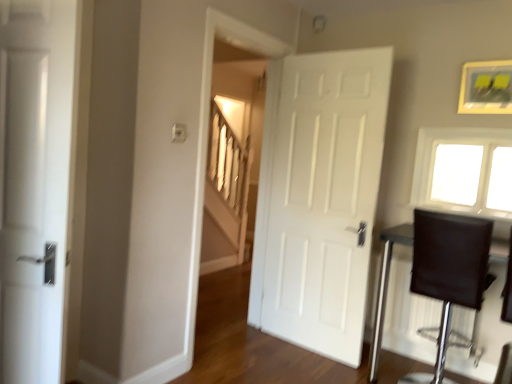
At what (x,y) coordinates should I click in order to perform the action: click on dark brown leather table at right. Please return your answer as a coordinate pair (x, y). The width and height of the screenshot is (512, 384). Looking at the image, I should click on point(386,287).

The width and height of the screenshot is (512, 384). Describe the element at coordinates (35, 184) in the screenshot. I see `white matte door at left, which is the first door in front-to-back order` at that location.

Where is `white matte door at left, which is counted as the second door, starting from the right`? The width and height of the screenshot is (512, 384). white matte door at left, which is counted as the second door, starting from the right is located at coordinates (35, 184).

Measure the distance between white glass window at upper right and camera.

The distance of white glass window at upper right from camera is 8.36 feet.

Find the location of a particular element. The width and height of the screenshot is (512, 384). white glass window at upper right is located at coordinates (464, 170).

Find the location of a particular element. dark brown leather table at right is located at coordinates (386, 287).

In the scene shown: In the image, is dark brown leather table at right positioned in front of or behind gold-framed picture at upper right?

dark brown leather table at right is positioned closer to the viewer than gold-framed picture at upper right.

Is dark brown leather table at right touching gold-framed picture at upper right?

dark brown leather table at right and gold-framed picture at upper right are clearly separated.

Does dark brown leather table at right appear on the right side of gold-framed picture at upper right?

No, dark brown leather table at right is not to the right of gold-framed picture at upper right.

From a real-world perspective, which object stands above the other?

gold-framed picture at upper right.

From the image's perspective, who appears lower, white glass window at upper right or white matte door at center, which is the 2th door in left-to-right order?

white matte door at center, which is the 2th door in left-to-right order, appears lower in the image.

Image resolution: width=512 pixels, height=384 pixels. There is a white glass window at upper right. What are the coordinates of `the 2nd door below it (from a real-world perspective)` in the screenshot? It's located at (319, 198).

How many degrees apart are the facing directions of white glass window at upper right and white matte door at center, which appears as the second door when viewed from the front?

3.4 degrees.

Are white matte door at left, which is counted as the 1th door, starting from the left, and white glass window at upper right beside each other?

white matte door at left, which is counted as the 1th door, starting from the left, is not next to white glass window at upper right, and they're not touching.

Would you say white matte door at left, which is counted as the 1th door, starting from the left, is inside or outside white glass window at upper right?

white matte door at left, which is counted as the 1th door, starting from the left, is outside white glass window at upper right.

Does white matte door at left, which is counted as the 1th door, starting from the left, come in front of white glass window at upper right?

Yes, the depth of white matte door at left, which is counted as the 1th door, starting from the left, is less than that of white glass window at upper right.

Is dark brown leather table at right to the left of white matte door at left, which is the first door in front-to-back order, from the viewer's perspective?

Incorrect, dark brown leather table at right is not on the left side of white matte door at left, which is the first door in front-to-back order.

How many degrees apart are the facing directions of dark brown leather table at right and white matte door at left, which is the first door in front-to-back order?

There is a 155-degree angle between the facing directions of dark brown leather table at right and white matte door at left, which is the first door in front-to-back order.

Is dark brown leather table at right not close to white matte door at left, which is the first door in front-to-back order?

dark brown leather table at right is far away from white matte door at left, which is the first door in front-to-back order.

Is point (405, 232) positioned behind point (37, 322)?

Yes, point (405, 232) is farther from viewer.

How different are the orientations of gold-framed picture at upper right and white matte door at left, placed as the second door when sorted from back to front, in degrees?

They differ by 155 degrees in their facing directions.

Is gold-framed picture at upper right shorter than white matte door at left, which is counted as the 1th door, starting from the left?

Indeed, gold-framed picture at upper right has a lesser height compared to white matte door at left, which is counted as the 1th door, starting from the left.

Considering the sizes of objects gold-framed picture at upper right and white matte door at left, which is counted as the 1th door, starting from the left, in the image provided, who is thinner, gold-framed picture at upper right or white matte door at left, which is counted as the 1th door, starting from the left,?

gold-framed picture at upper right.

The width and height of the screenshot is (512, 384). In order to click on the 1st door directly beneath the gold-framed picture at upper right (from a real-world perspective) in this screenshot , I will do `click(35, 184)`.

Is point (16, 224) farther from viewer compared to point (412, 239)?

No.

Considering the sizes of objects white matte door at left, which is the first door in front-to-back order, and dark brown leather table at right in the image provided, who is smaller, white matte door at left, which is the first door in front-to-back order, or dark brown leather table at right?

With smaller size is white matte door at left, which is the first door in front-to-back order.

From the image's perspective, which one is positioned lower, white matte door at left, which is counted as the 1th door, starting from the left, or dark brown leather table at right?

dark brown leather table at right, from the image's perspective.

Considering the positions of point (474, 105) and point (388, 231), is point (474, 105) closer or farther from the camera than point (388, 231)?

Point (474, 105) is closer to the camera than point (388, 231).

Which is correct: gold-framed picture at upper right is inside dark brown leather table at right, or outside of it?

gold-framed picture at upper right lies outside dark brown leather table at right.

Who is smaller, gold-framed picture at upper right or dark brown leather table at right?

gold-framed picture at upper right is smaller.

How different are the orientations of gold-framed picture at upper right and dark brown leather table at right in degrees?

0.204 degrees separate the facing orientations of gold-framed picture at upper right and dark brown leather table at right.

The image size is (512, 384). Find the location of `table located on the left of gold-framed picture at upper right`. table located on the left of gold-framed picture at upper right is located at coordinates (386, 287).

Find the location of `door behind the white glass window at upper right`. door behind the white glass window at upper right is located at coordinates (319, 198).

Estimate the real-world distances between objects in this image. Which object is closer to white glass window at upper right, white matte door at center, which is the 2th door in left-to-right order, or dark brown leather table at right?

Based on the image, dark brown leather table at right appears to be nearer to white glass window at upper right.

From the image, which object appears to be nearer to gold-framed picture at upper right, white glass window at upper right or dark brown leather table at right?

The object closer to gold-framed picture at upper right is white glass window at upper right.

Which object lies further to the anchor point dark brown leather table at right, white glass window at upper right or white matte door at center, which appears as the second door when viewed from the front?

white matte door at center, which appears as the second door when viewed from the front.

In the scene shown: Estimate the real-world distances between objects in this image. Which object is further from white matte door at center, which appears as the second door when viewed from the front, white glass window at upper right or dark brown leather table at right?

white glass window at upper right is positioned further to the anchor white matte door at center, which appears as the second door when viewed from the front.

Which object lies nearer to the anchor point gold-framed picture at upper right, dark brown leather table at right or white matte door at center, the first door viewed from the back?

Among the two, white matte door at center, the first door viewed from the back, is located nearer to gold-framed picture at upper right.

Estimate the real-world distances between objects in this image. Which object is further from gold-framed picture at upper right, dark brown leather table at right or white glass window at upper right?

Among the two, dark brown leather table at right is located further to gold-framed picture at upper right.

Which object lies further to the anchor point white matte door at center, the first door viewed from the back, dark brown leather table at right or white matte door at left, which is counted as the 1th door, starting from the left?

The object further to white matte door at center, the first door viewed from the back, is white matte door at left, which is counted as the 1th door, starting from the left.

Based on the photo, from the image, which object appears to be nearer to white matte door at left, which is the first door in front-to-back order, white glass window at upper right or gold-framed picture at upper right?

white glass window at upper right.

The image size is (512, 384). In order to click on door located between white matte door at left, placed as the second door when sorted from back to front, and white glass window at upper right in the left-right direction in this screenshot , I will do `click(319, 198)`.

Where is `table between white matte door at left, which is counted as the 1th door, starting from the left, and gold-framed picture at upper right`? Image resolution: width=512 pixels, height=384 pixels. table between white matte door at left, which is counted as the 1th door, starting from the left, and gold-framed picture at upper right is located at coordinates (386, 287).

You are a GUI agent. You are given a task and a screenshot of the screen. Output one action in this format:
    pyautogui.click(x=<x>, y=<y>)
    Task: Click on the window between gold-framed picture at upper right and dark brown leather table at right from top to bottom
    This screenshot has height=384, width=512.
    Given the screenshot: What is the action you would take?
    pyautogui.click(x=464, y=170)

Where is `window situated between white matte door at center, which is the 2th door in left-to-right order, and gold-framed picture at upper right from left to right`? The width and height of the screenshot is (512, 384). window situated between white matte door at center, which is the 2th door in left-to-right order, and gold-framed picture at upper right from left to right is located at coordinates tap(464, 170).